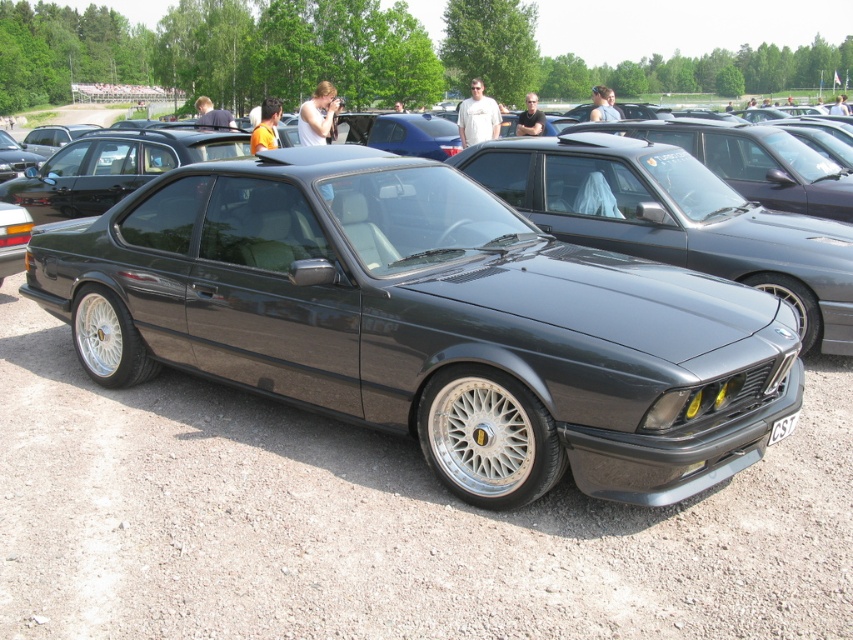
Can you confirm if metallic gray car at center is positioned above black plastic license plate at center?

Correct, metallic gray car at center is located above black plastic license plate at center.

Can you confirm if metallic gray car at center is thinner than black plastic license plate at center?

No.

Does point (320, 218) come behind point (770, 429)?

Yes, it is.

This screenshot has width=853, height=640. What are the coordinates of `metallic gray car at center` in the screenshot? It's located at (427, 323).

Does metallic gray car at center appear on the left side of satin black car at center?

Indeed, metallic gray car at center is positioned on the left side of satin black car at center.

How much distance is there between metallic gray car at center and satin black car at center?

metallic gray car at center is 2.31 meters from satin black car at center.

Which is in front, point (788, 374) or point (605, 196)?

Positioned in front is point (788, 374).

You are a GUI agent. You are given a task and a screenshot of the screen. Output one action in this format:
    pyautogui.click(x=<x>, y=<y>)
    Task: Click on the metallic gray car at center
    
    Given the screenshot: What is the action you would take?
    pyautogui.click(x=427, y=323)

Between point (817, 333) and point (784, 419), which one is positioned in front?

Point (784, 419)

The height and width of the screenshot is (640, 853). I want to click on satin black car at center, so click(674, 220).

The image size is (853, 640). What do you see at coordinates (674, 220) in the screenshot? I see `satin black car at center` at bounding box center [674, 220].

You are a GUI agent. You are given a task and a screenshot of the screen. Output one action in this format:
    pyautogui.click(x=<x>, y=<y>)
    Task: Click on the satin black car at center
    Image resolution: width=853 pixels, height=640 pixels.
    Given the screenshot: What is the action you would take?
    pyautogui.click(x=674, y=220)